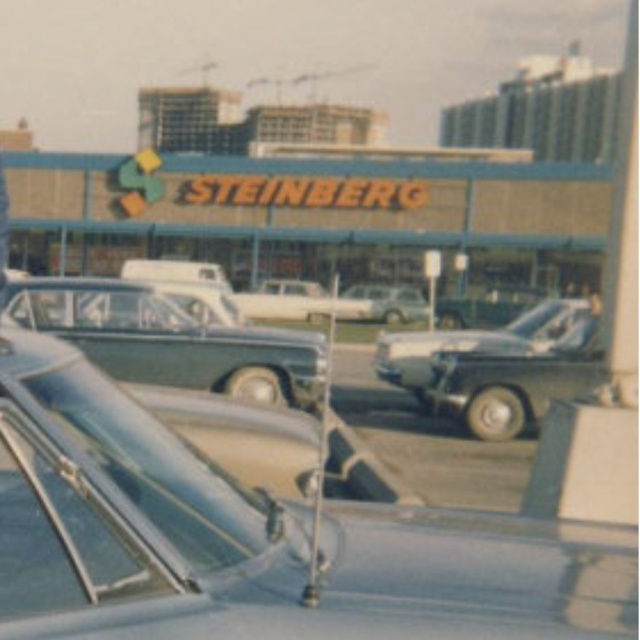
Which is in front, point (76, 326) or point (372, 312)?

Point (76, 326) is in front.

In the scene shown: Which of these two, shiny silver sedan at center or white glossy station wagon at center, stands taller?

white glossy station wagon at center

This screenshot has height=640, width=640. Identify the location of shiny silver sedan at center. (170, 339).

Is shiny silver car at center wider than white glossy sedan at center?

No.

Does shiny silver car at center come behind white glossy sedan at center?

That is False.

Is point (531, 355) positioned behind point (376, 314)?

No, it is not.

Where is `shiny silver car at center`? Image resolution: width=640 pixels, height=640 pixels. shiny silver car at center is located at coordinates (493, 364).

Does point (308, 282) come in front of point (401, 308)?

No, it is behind (401, 308).

Consider the image. Who is shorter, white glossy station wagon at center or white glossy sedan at center?

Standing shorter between the two is white glossy sedan at center.

Describe the element at coordinates (284, 300) in the screenshot. Image resolution: width=640 pixels, height=640 pixels. I see `white glossy station wagon at center` at that location.

You are a GUI agent. You are given a task and a screenshot of the screen. Output one action in this format:
    pyautogui.click(x=<x>, y=<y>)
    Task: Click on the white glossy station wagon at center
    The image size is (640, 640).
    Given the screenshot: What is the action you would take?
    pyautogui.click(x=284, y=300)